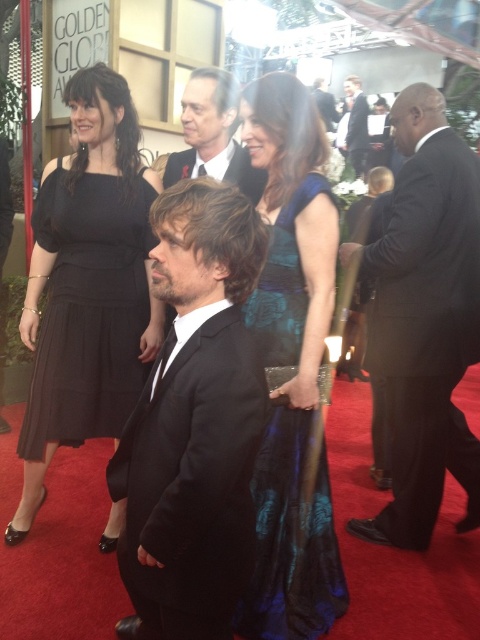
Can you confirm if teal satin dress at center is bigger than smooth black suit at center?

No, teal satin dress at center is not bigger than smooth black suit at center.

What do you see at coordinates (290, 362) in the screenshot? This screenshot has width=480, height=640. I see `teal satin dress at center` at bounding box center [290, 362].

Find the location of a particular element. This screenshot has height=640, width=480. teal satin dress at center is located at coordinates (290, 362).

Does black satin suit at center have a greater width compared to black suit at center?

Correct, the width of black satin suit at center exceeds that of black suit at center.

Can you confirm if black satin suit at center is smaller than black suit at center?

Correct, black satin suit at center occupies less space than black suit at center.

Between point (206, 426) and point (352, 76), which one is positioned in front?

Positioned in front is point (206, 426).

Identify the location of black satin suit at center. The image size is (480, 640). (193, 422).

Who is higher up, black suit at right or smooth black suit at center?

Positioned higher is smooth black suit at center.

Which is in front, point (444, 224) or point (206, 120)?

Point (444, 224)

Identify the location of black suit at right. The height and width of the screenshot is (640, 480). [425, 321].